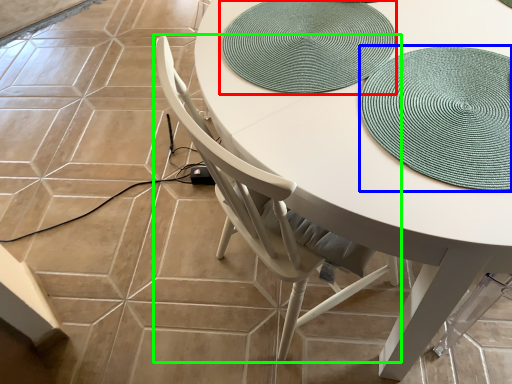
Question: Considering the real-world distances, which object is farthest from mat (highlighted by a red box)? hat (highlighted by a blue box) or chair (highlighted by a green box)?

Choices:
 (A) hat
 (B) chair

Answer: (B)